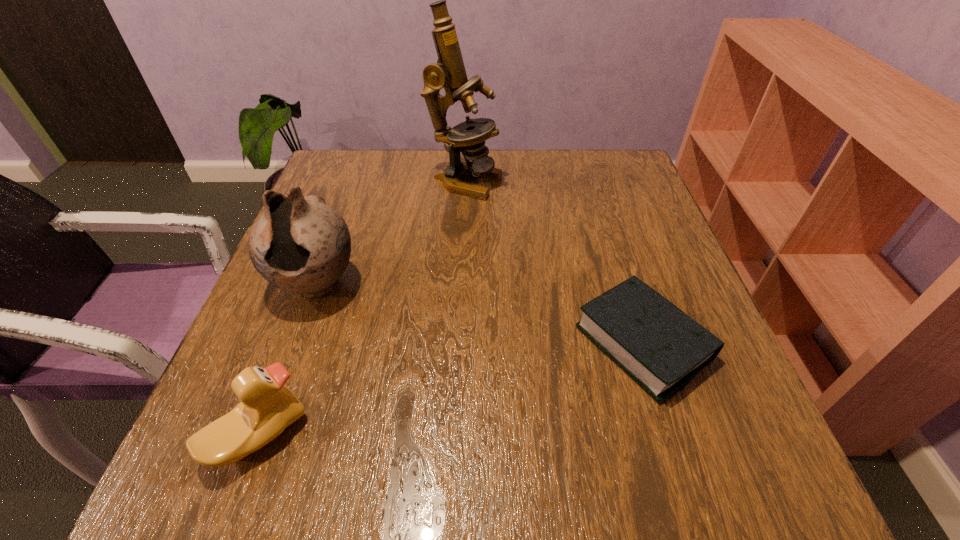
What are the coordinates of `the second object from right to left` in the screenshot? It's located at [468, 137].

Find the location of a particular element. The width and height of the screenshot is (960, 540). microscope is located at coordinates (468, 137).

This screenshot has height=540, width=960. Identify the location of pottery. pos(299,244).

Where is `the third tallest object`? The height and width of the screenshot is (540, 960). the third tallest object is located at coordinates (267, 407).

Find the location of a particular element. Bible is located at coordinates (658, 345).

Find the location of a particular element. The width and height of the screenshot is (960, 540). the shortest object is located at coordinates (658, 345).

Locate an element on the screen. The image size is (960, 540). free spot located 0.170m on the right of the farthest object is located at coordinates (569, 182).

This screenshot has width=960, height=540. I want to click on vacant region located from the spout of the second tallest object, so click(246, 476).

I want to click on free region located at the beak of the duck, so click(338, 435).

Identify the location of blank space located on the left of the Bible. The height and width of the screenshot is (540, 960). (347, 343).